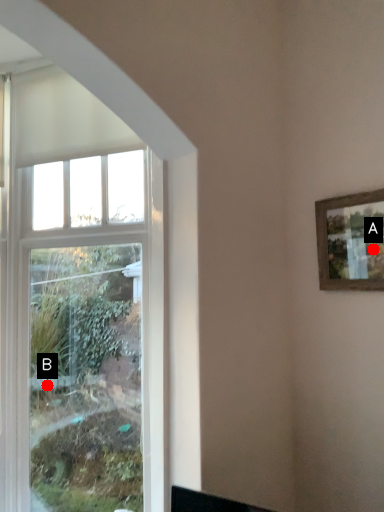
Question: Two points are circled on the image, labeled by A and B beside each circle. Which of the following is the closest to the observer?

Choices:
 (A) A is closer
 (B) B is closer

Answer: (A)